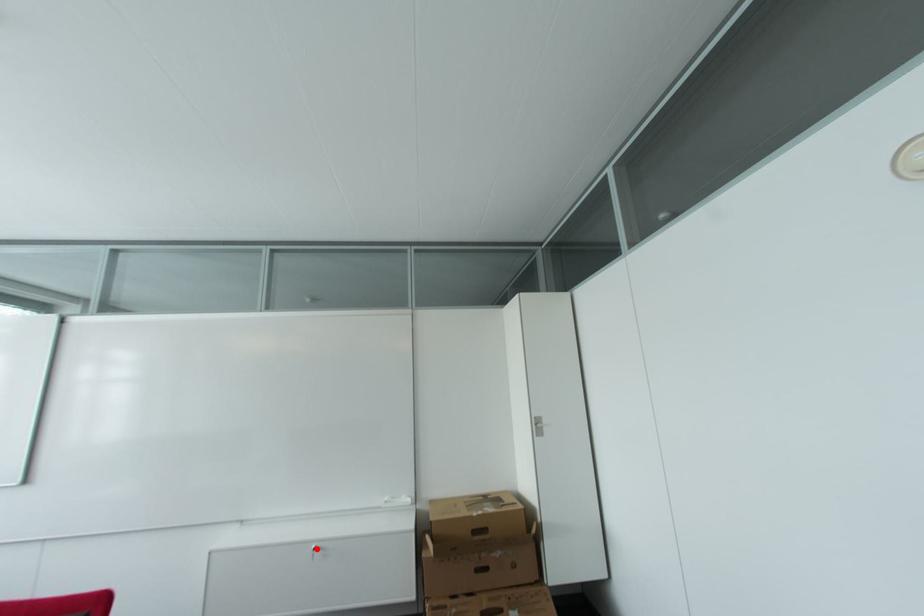
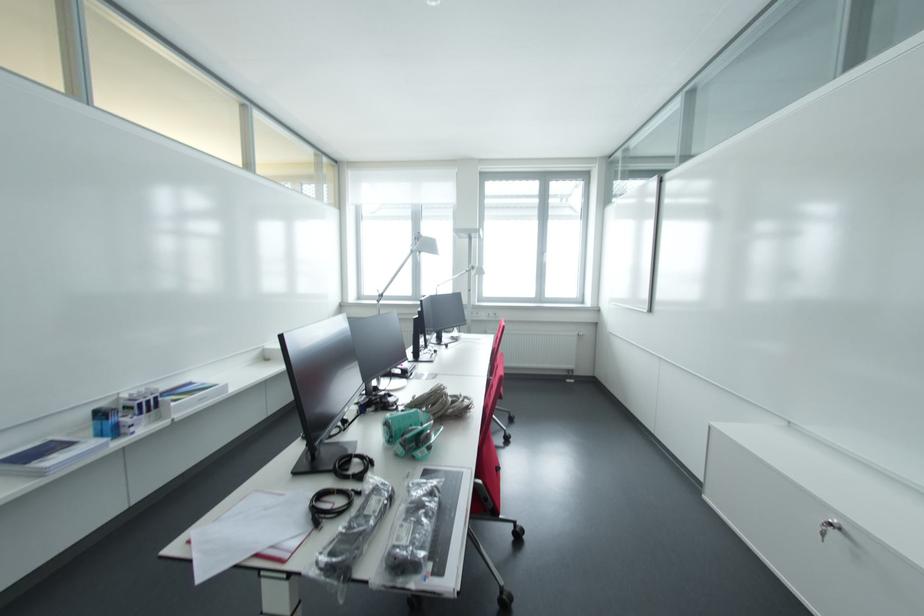
Locate, in the second image, the point that corresponds to the highlighted location in the first image.

(836, 525)